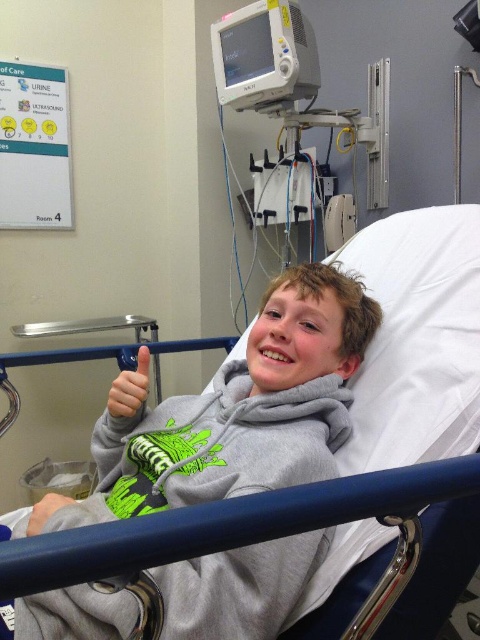
Is white plastic monitor at upper center smaller than matte gray glove at lower left?

Incorrect, white plastic monitor at upper center is not smaller in size than matte gray glove at lower left.

Where is `white plastic monitor at upper center`? white plastic monitor at upper center is located at coordinates (295, 81).

You are a GUI agent. You are given a task and a screenshot of the screen. Output one action in this format:
    pyautogui.click(x=<x>, y=<y>)
    Task: Click on the white plastic monitor at upper center
    
    Given the screenshot: What is the action you would take?
    pyautogui.click(x=295, y=81)

Can you confirm if gray matte hoodie at center is positioned below white plastic monitor at upper center?

Yes.

Can you confirm if gray matte hoodie at center is bigger than white plastic monitor at upper center?

Incorrect, gray matte hoodie at center is not larger than white plastic monitor at upper center.

The width and height of the screenshot is (480, 640). What do you see at coordinates (242, 410) in the screenshot?
I see `gray matte hoodie at center` at bounding box center [242, 410].

The image size is (480, 640). What are the coordinates of `gray matte hoodie at center` in the screenshot? It's located at (242, 410).

Who is more forward, (129, 416) or (29, 529)?

Point (29, 529)

Is matte gray glove at lower left behind gray fabric hand at lower left?

Yes, it is.

Who is more forward, (120, 417) or (27, 522)?

Point (120, 417) is in front.

What are the coordinates of `matte gray glove at lower left` in the screenshot? It's located at (130, 387).